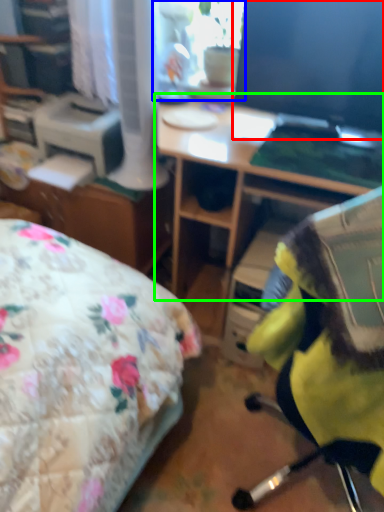
Question: Which object is the closest to the computer monitor (highlighted by a red box)? Choose among these: window screen (highlighted by a blue box) or desk (highlighted by a green box).

Choices:
 (A) window screen
 (B) desk

Answer: (B)